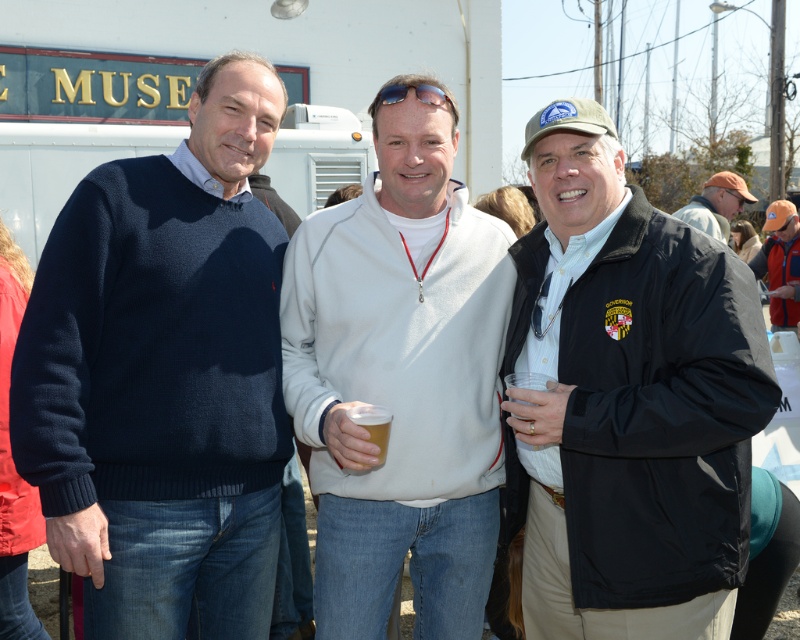
You are taking a photo of the scene and want to ensure both the navy blue sweater at left and the brown cap at upper right are in frame. Which object is closer to the left edge of the photo?

The navy blue sweater at left is closer to the left edge of the photo since it is positioned on the left side of the brown cap at upper right.

You are standing in front of the museum sign and see two points marked in the image. Which point, point (202, 522) or point (732, 182), is closer to you?

Point (202, 522) is closer to the viewer than point (732, 182).